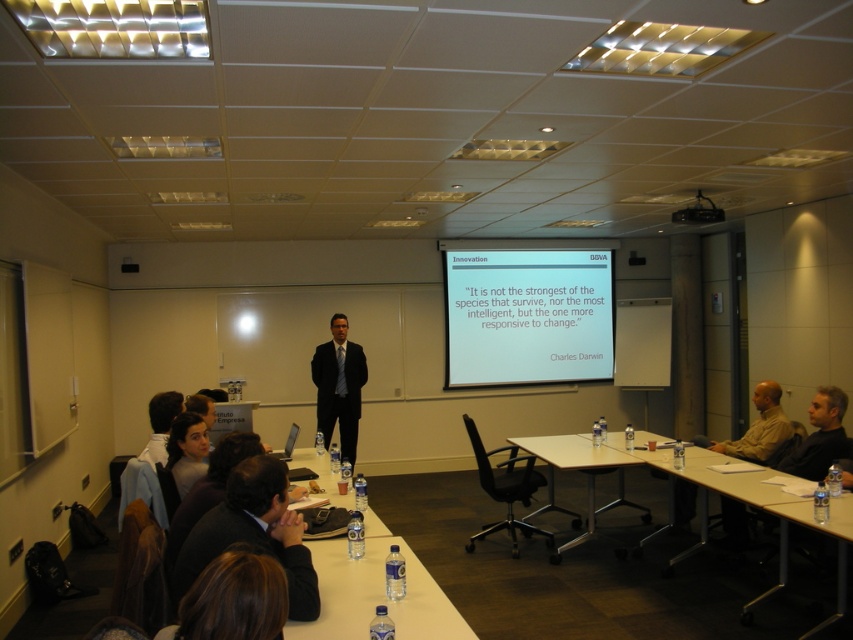
Does white matte projector screen at upper center appear on the left side of matte black suit at center?

No, white matte projector screen at upper center is not to the left of matte black suit at center.

Who is positioned more to the left, white matte projector screen at upper center or matte black suit at center?

From the viewer's perspective, matte black suit at center appears more on the left side.

Is point (581, 266) positioned behind point (323, 419)?

Yes.

The height and width of the screenshot is (640, 853). Find the location of `white matte projector screen at upper center`. white matte projector screen at upper center is located at coordinates (527, 316).

Measure the distance from matte black suit at center to black plastic projector at upper center.

They are 3.44 meters apart.

Between point (323, 433) and point (694, 205), which one is positioned behind?

The point (694, 205) is more distant.

Locate an element on the screen. matte black suit at center is located at coordinates (339, 392).

Who is shorter, white matte projector screen at upper center or dark brown suit at lower center?

Standing shorter between the two is dark brown suit at lower center.

Which is behind, point (527, 376) or point (282, 465)?

The point (527, 376) is more distant.

This screenshot has width=853, height=640. In order to click on white matte projector screen at upper center in this screenshot , I will do `click(527, 316)`.